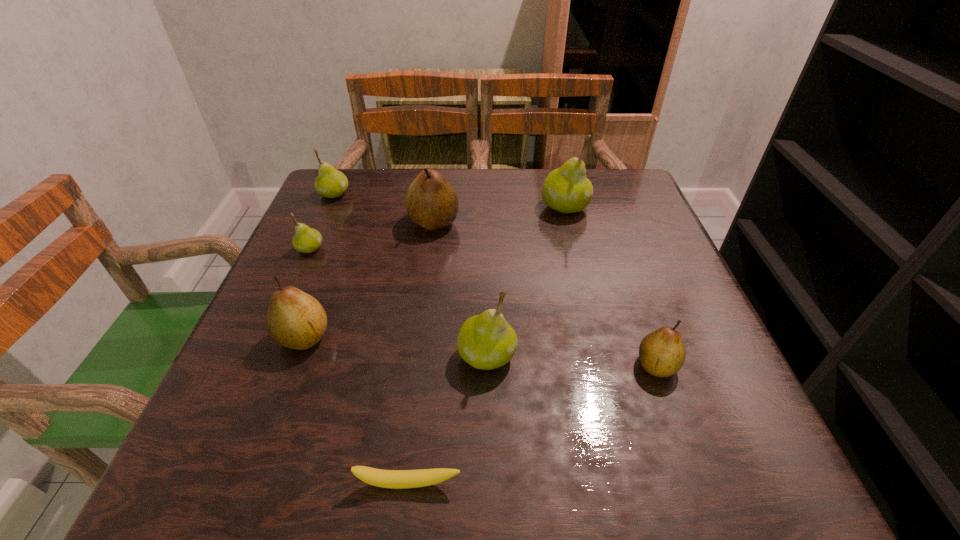
At what (x,y) coordinates should I click in order to perform the action: click on the biggest green pear. Please return your answer as a coordinate pair (x, y). This screenshot has width=960, height=540. Looking at the image, I should click on (567, 189).

This screenshot has width=960, height=540. I want to click on the tallest pear, so click(567, 189).

Image resolution: width=960 pixels, height=540 pixels. What are the coordinates of `the biggest brown pear` in the screenshot? It's located at (431, 202).

Where is `the fourth pear from left to right`? This screenshot has height=540, width=960. the fourth pear from left to right is located at coordinates (431, 202).

At what (x,y) coordinates should I click in order to perform the action: click on the nearest green pear. Please return your answer as a coordinate pair (x, y). The height and width of the screenshot is (540, 960). Looking at the image, I should click on (487, 341).

Image resolution: width=960 pixels, height=540 pixels. Identify the location of the third green pear from left to right. (487, 341).

The image size is (960, 540). I want to click on the third biggest green pear, so click(x=331, y=183).

The image size is (960, 540). In order to click on the second biggest brown pear in this screenshot , I will do `click(295, 320)`.

Where is `the smallest brown pear`? This screenshot has width=960, height=540. the smallest brown pear is located at coordinates (662, 353).

You are a GUI agent. You are given a task and a screenshot of the screen. Output one action in this format:
    pyautogui.click(x=<x>, y=<y>)
    Task: Click on the third farthest green pear
    
    Given the screenshot: What is the action you would take?
    pyautogui.click(x=306, y=240)